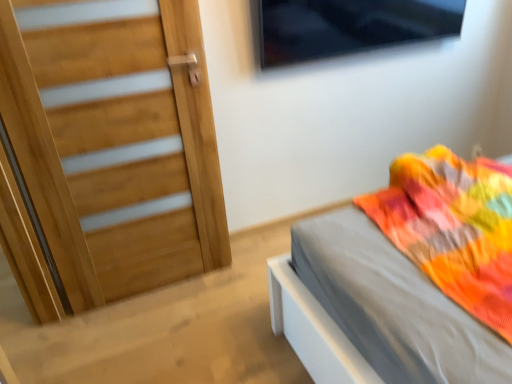
Question: From the image's perspective, is matte gray bed at right positioned above or below transparent glass window at upper center?

Choices:
 (A) above
 (B) below

Answer: (B)

Question: Considering the positions of matte gray bed at right and transparent glass window at upper center in the image, is matte gray bed at right bigger or smaller than transparent glass window at upper center?

Choices:
 (A) small
 (B) big

Answer: (B)

Question: Which object is positioned farthest from the transparent glass window at upper center?

Choices:
 (A) natural wood door at left
 (B) matte gray bed at right

Answer: (B)

Question: Which object is the farthest from the matte gray bed at right?

Choices:
 (A) transparent glass window at upper center
 (B) natural wood door at left

Answer: (A)